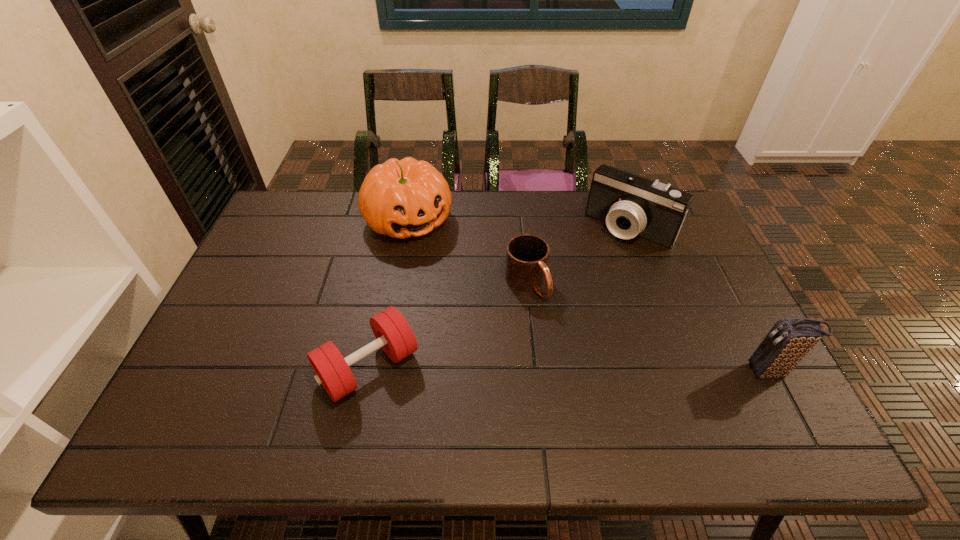
Find the location of a particular element. blank space located on the side of the third object from right to left with the handle is located at coordinates (618, 395).

You are a GUI agent. You are given a task and a screenshot of the screen. Output one action in this format:
    pyautogui.click(x=<x>, y=<y>)
    Task: Click on the blank space located on the side of the third object from right to left with the handle
    The width and height of the screenshot is (960, 540).
    Given the screenshot: What is the action you would take?
    pyautogui.click(x=562, y=328)

Locate an element on the screen. The height and width of the screenshot is (540, 960). vacant point located 0.130m on the side of the third object from right to left with the handle is located at coordinates (568, 336).

Identify the location of vacant region located on the carved face of the pumpkin. (489, 325).

Locate an element on the screen. The width and height of the screenshot is (960, 540). vacant space located 0.340m on the carved face of the pumpkin is located at coordinates (483, 318).

Find the location of a particular element. Image resolution: width=960 pixels, height=540 pixels. vacant region located on the carved face of the pumpkin is located at coordinates (444, 265).

Identify the location of free space located on the lens of the fourth object from left to right. The image size is (960, 540). (591, 269).

Identify the location of vacant space located 0.070m on the lens of the fourth object from left to right. (600, 258).

Locate an element on the screen. vacant space positioned on the lens of the fourth object from left to right is located at coordinates (600, 258).

At what (x,y) coordinates should I click in order to perform the action: click on pumpkin that is at the far edge. Please return your answer as a coordinate pair (x, y). The image size is (960, 540). Looking at the image, I should click on (401, 198).